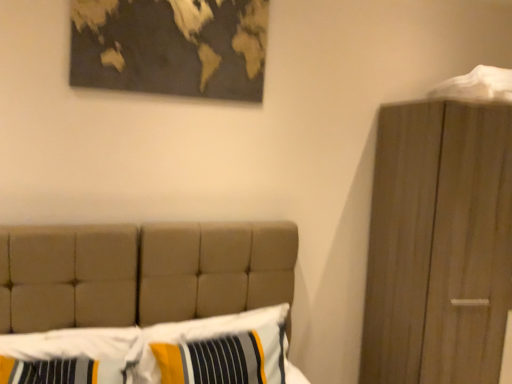
Image resolution: width=512 pixels, height=384 pixels. I want to click on white fabric at upper right, so click(x=477, y=86).

Find the location of a particular element. Image resolution: width=512 pixels, height=384 pixels. gold metallic map at upper center is located at coordinates (170, 46).

What do you see at coordinates (141, 273) in the screenshot? I see `textured beige bed at center` at bounding box center [141, 273].

What are the coordinates of `striped fabric pillow at center, arranged as the second pillow when viewed from the left` in the screenshot? It's located at (202, 333).

Does point (156, 64) come farther from viewer compared to point (36, 333)?

That is True.

From the image's perspective, which one is positioned higher, gold metallic map at upper center or striped fabric pillow at lower left, the second pillow viewed from the right?

From the image's view, gold metallic map at upper center is above.

Is gold metallic map at upper center positioned far away from striped fabric pillow at lower left, which appears as the 1th pillow when viewed from the left?

Yes, gold metallic map at upper center and striped fabric pillow at lower left, which appears as the 1th pillow when viewed from the left, are quite far apart.

Considering the relative sizes of striped fabric pillow at center, arranged as the second pillow when viewed from the left, and white fabric at upper right in the image provided, is striped fabric pillow at center, arranged as the second pillow when viewed from the left, taller than white fabric at upper right?

Yes.

Starting from the white fabric at upper right, which pillow is the 1st one in front? Please provide its 2D coordinates.

[(202, 333)]

Looking at this image, do you think striped fabric pillow at center, the first pillow viewed from the right, is within white fabric at upper right, or outside of it?

striped fabric pillow at center, the first pillow viewed from the right, lies outside white fabric at upper right.

From the image's perspective, would you say gold metallic map at upper center is shown under white fabric at upper right?

No, from the image's perspective, gold metallic map at upper center is not beneath white fabric at upper right.

Consider the image. Based on their positions, is gold metallic map at upper center located to the left or right of white fabric at upper right?

From the image, it's evident that gold metallic map at upper center is to the left of white fabric at upper right.

Is gold metallic map at upper center not near white fabric at upper right?

That's right, there is a large distance between gold metallic map at upper center and white fabric at upper right.

From a real-world perspective, between textured beige bed at center and white fabric at upper right, who is vertically lower?

textured beige bed at center.

Is textured beige bed at center oriented towards white fabric at upper right?

No, textured beige bed at center is not turned towards white fabric at upper right.

Considering the sizes of objects textured beige bed at center and white fabric at upper right in the image provided, who is bigger, textured beige bed at center or white fabric at upper right?

textured beige bed at center.

There is a textured beige bed at center. Where is `sheet above it (from a real-world perspective)`? Image resolution: width=512 pixels, height=384 pixels. sheet above it (from a real-world perspective) is located at coordinates (477, 86).

Can you confirm if gold metallic map at upper center is taller than textured beige bed at center?

No.

Considering the relative sizes of gold metallic map at upper center and textured beige bed at center in the image provided, is gold metallic map at upper center smaller than textured beige bed at center?

Yes, gold metallic map at upper center is smaller than textured beige bed at center.

Considering the points (219, 1) and (3, 235), which point is in front, point (219, 1) or point (3, 235)?

Point (3, 235)

In the image, there is a striped fabric pillow at center, arranged as the second pillow when viewed from the left. Identify the location of sheet above it (from the image's perspective). Image resolution: width=512 pixels, height=384 pixels. (477, 86).

From a real-world perspective, does white fabric at upper right stand above striped fabric pillow at center, arranged as the second pillow when viewed from the left?

Yes, from a real-world perspective, white fabric at upper right is on top of striped fabric pillow at center, arranged as the second pillow when viewed from the left.

Does white fabric at upper right touch striped fabric pillow at center, the first pillow viewed from the right?

No, white fabric at upper right is not touching striped fabric pillow at center, the first pillow viewed from the right.

Choose the correct answer: Is white fabric at upper right inside striped fabric pillow at center, the first pillow viewed from the right, or outside it?

The correct answer is: outside.

Is striped fabric pillow at center, the first pillow viewed from the right, facing towards striped fabric pillow at lower left, the second pillow viewed from the right?

No.

Where is `pillow above the striped fabric pillow at center, arranged as the second pillow when viewed from the left (from a real-world perspective)`? The height and width of the screenshot is (384, 512). pillow above the striped fabric pillow at center, arranged as the second pillow when viewed from the left (from a real-world perspective) is located at coordinates (70, 356).

From the image's perspective, which one is positioned lower, striped fabric pillow at center, the first pillow viewed from the right, or striped fabric pillow at lower left, the second pillow viewed from the right?

striped fabric pillow at center, the first pillow viewed from the right, from the image's perspective.

Where is `picture frame on the right of striped fabric pillow at lower left, which appears as the 1th pillow when viewed from the left`? picture frame on the right of striped fabric pillow at lower left, which appears as the 1th pillow when viewed from the left is located at coordinates (170, 46).

This screenshot has width=512, height=384. In order to click on sheet above the striped fabric pillow at center, arranged as the second pillow when viewed from the left (from a real-world perspective) in this screenshot , I will do `click(477, 86)`.

Estimate the real-world distances between objects in this image. Which object is closer to striped fabric pillow at center, arranged as the second pillow when viewed from the left, striped fabric pillow at lower left, which appears as the 1th pillow when viewed from the left, or white fabric at upper right?

Among the two, striped fabric pillow at lower left, which appears as the 1th pillow when viewed from the left, is located nearer to striped fabric pillow at center, arranged as the second pillow when viewed from the left.

Based on their spatial positions, is striped fabric pillow at lower left, which appears as the 1th pillow when viewed from the left, or striped fabric pillow at center, the first pillow viewed from the right, closer to textured beige bed at center?

striped fabric pillow at center, the first pillow viewed from the right.

Considering their positions, is striped fabric pillow at lower left, the second pillow viewed from the right, positioned closer to white fabric at upper right than gold metallic map at upper center?

Based on the image, gold metallic map at upper center appears to be nearer to white fabric at upper right.

Estimate the real-world distances between objects in this image. Which object is further from striped fabric pillow at center, arranged as the second pillow when viewed from the left, textured beige bed at center or white fabric at upper right?

white fabric at upper right.

Estimate the real-world distances between objects in this image. Which object is further from textured beige bed at center, white fabric at upper right or striped fabric pillow at center, arranged as the second pillow when viewed from the left?

white fabric at upper right.

Based on their spatial positions, is gold metallic map at upper center or striped fabric pillow at center, arranged as the second pillow when viewed from the left, closer to textured beige bed at center?

Based on the image, striped fabric pillow at center, arranged as the second pillow when viewed from the left, appears to be nearer to textured beige bed at center.

Estimate the real-world distances between objects in this image. Which object is closer to white fabric at upper right, gold metallic map at upper center or striped fabric pillow at lower left, which appears as the 1th pillow when viewed from the left?

gold metallic map at upper center is positioned closer to the anchor white fabric at upper right.

Considering their positions, is textured beige bed at center positioned further to striped fabric pillow at center, the first pillow viewed from the right, than striped fabric pillow at lower left, which appears as the 1th pillow when viewed from the left?

Among the two, striped fabric pillow at lower left, which appears as the 1th pillow when viewed from the left, is located further to striped fabric pillow at center, the first pillow viewed from the right.

At what (x,y) coordinates should I click in order to perform the action: click on bed between striped fabric pillow at lower left, which appears as the 1th pillow when viewed from the left, and white fabric at upper right. Please return your answer as a coordinate pair (x, y). The image size is (512, 384). Looking at the image, I should click on (141, 273).

Where is `pillow between striped fabric pillow at lower left, which appears as the 1th pillow when viewed from the left, and white fabric at upper right`? pillow between striped fabric pillow at lower left, which appears as the 1th pillow when viewed from the left, and white fabric at upper right is located at coordinates (202, 333).

Find the location of `picture frame between striped fabric pillow at lower left, which appears as the 1th pillow when viewed from the left, and white fabric at upper right from left to right`. picture frame between striped fabric pillow at lower left, which appears as the 1th pillow when viewed from the left, and white fabric at upper right from left to right is located at coordinates (170, 46).

In order to click on bed that lies between gold metallic map at upper center and striped fabric pillow at lower left, the second pillow viewed from the right, from top to bottom in this screenshot , I will do tap(141, 273).